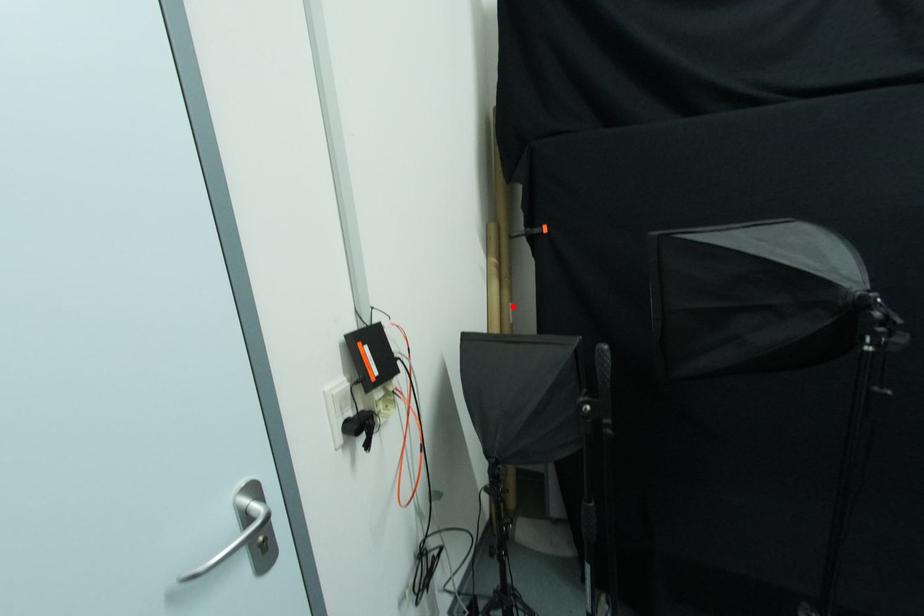
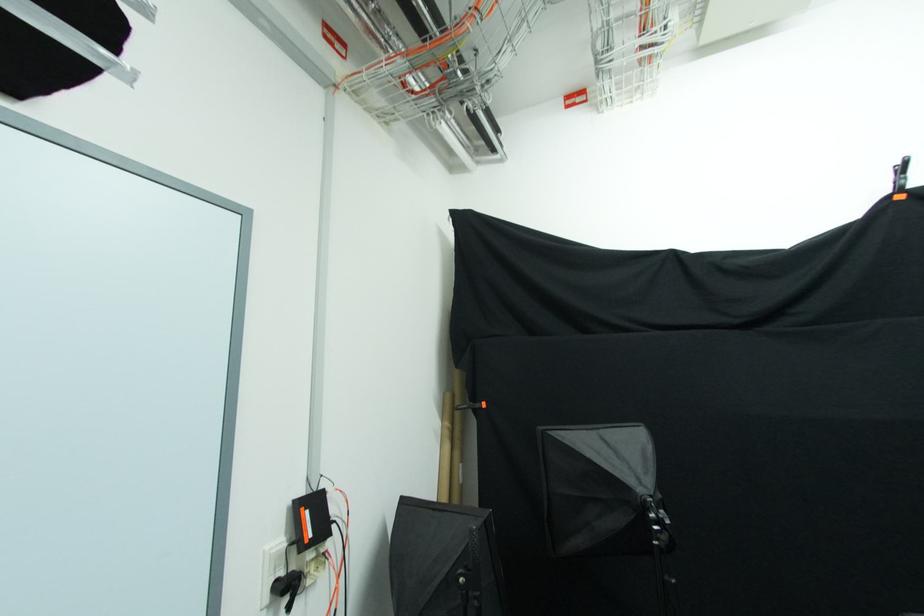
Question: I am providing you with two images of the same scene from different viewpoints. In image1, a red point is highlighted. Considering the same 3D point in image2, which of the following is correct?

Choices:
 (A) It is closer
 (B) It is farther

Answer: (B)